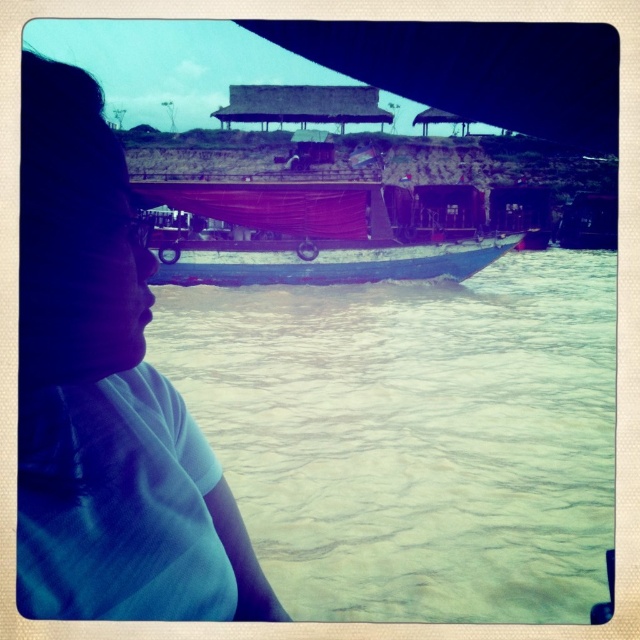
Question: Does greenish murky water at center appear on the right side of wooden boat at center?

Choices:
 (A) no
 (B) yes

Answer: (A)

Question: Is white matte shirt at left above wooden boat at center?

Choices:
 (A) yes
 (B) no

Answer: (B)

Question: Which is nearer to the wooden boat at center?

Choices:
 (A) white matte shirt at left
 (B) greenish murky water at center

Answer: (B)

Question: Estimate the real-world distances between objects in this image. Which object is closer to the wooden boat at center?

Choices:
 (A) greenish murky water at center
 (B) white matte shirt at left

Answer: (A)

Question: Which object appears closest to the camera in this image?

Choices:
 (A) white matte shirt at left
 (B) wooden boat at center
 (C) greenish murky water at center

Answer: (A)

Question: Does greenish murky water at center have a larger size compared to wooden boat at center?

Choices:
 (A) yes
 (B) no

Answer: (A)